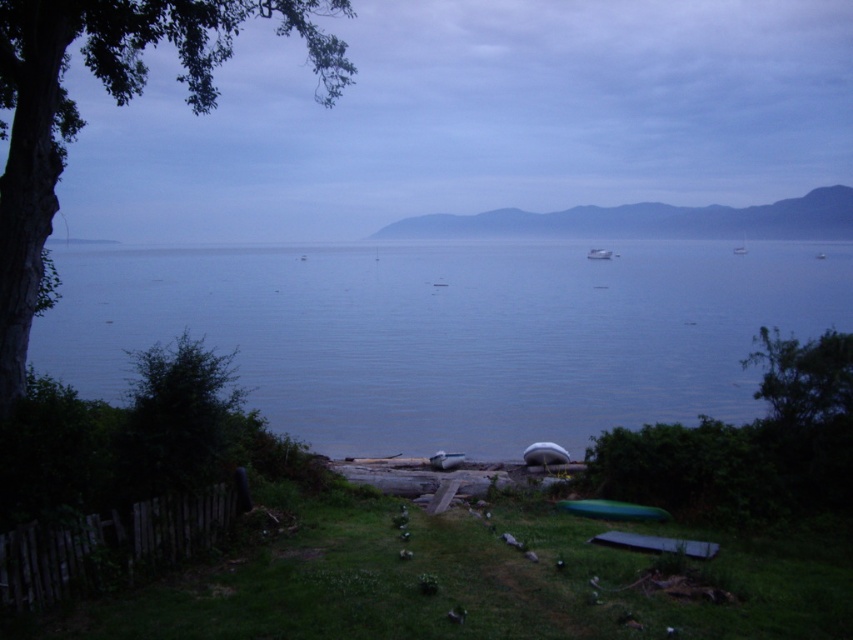
Question: Which is nearer to the blue water at center?

Choices:
 (A) green leafy tree at left
 (B) white glossy boat at center
 (C) white rubber boat at center

Answer: (B)

Question: Can you confirm if white rubber boat at center is bigger than white matte boat at center?

Choices:
 (A) yes
 (B) no

Answer: (A)

Question: Can you confirm if green leafy tree at left is smaller than white rubber boat at center?

Choices:
 (A) no
 (B) yes

Answer: (A)

Question: Which object appears closest to the camera in this image?

Choices:
 (A) green leafy tree at left
 (B) blue water at center
 (C) white rubber boat at center

Answer: (A)

Question: Estimate the real-world distances between objects in this image. Which object is farther from the white rubber boat at center?

Choices:
 (A) green leafy tree at left
 (B) white matte boat at center

Answer: (A)

Question: Does green leafy tree at left appear on the left side of white matte boat at center?

Choices:
 (A) yes
 (B) no

Answer: (A)